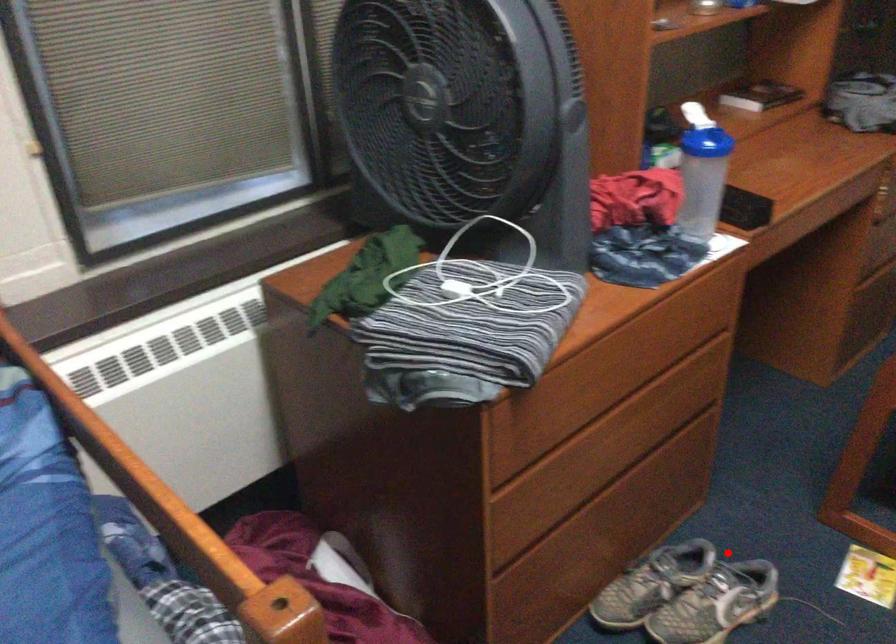
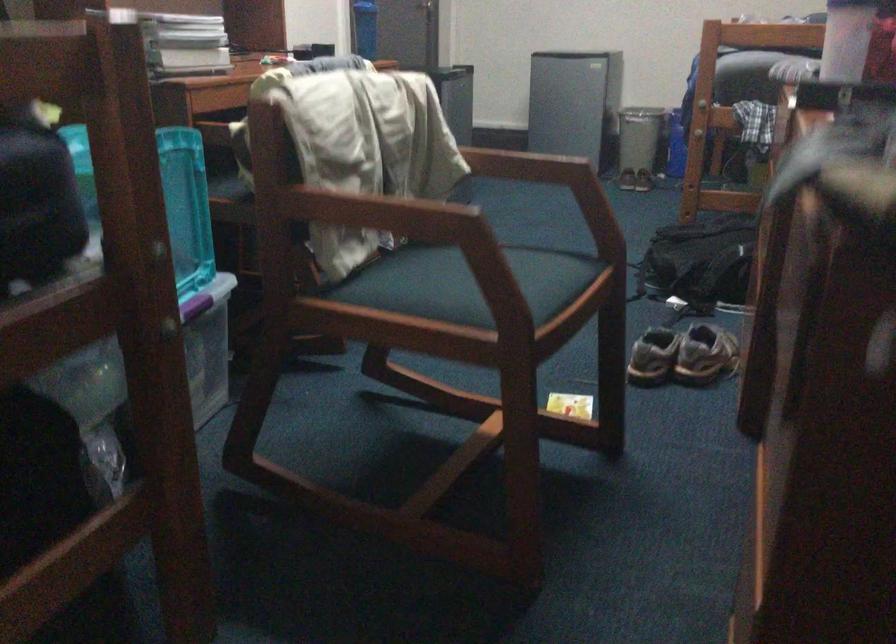
Where in the second image is the point corresponding to the highlighted location from the first image?

(682, 355)